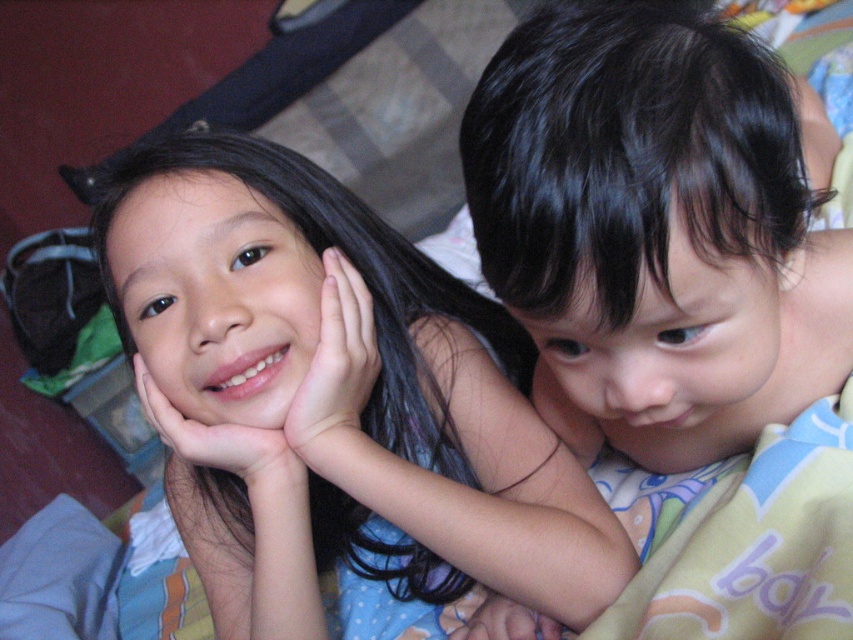
Is pink flesh-toned hand at center shorter than smooth skin hand at lower right?

No, pink flesh-toned hand at center is not shorter than smooth skin hand at lower right.

Is point (352, 314) farther from camera compared to point (560, 403)?

No, it is not.

Where is `pink flesh-toned hand at center`? This screenshot has width=853, height=640. pink flesh-toned hand at center is located at coordinates (335, 369).

Which of these two, smooth black hair at upper right or pink flesh-toned hand at center, stands taller?

Standing taller between the two is smooth black hair at upper right.

Is smooth black hair at upper right bigger than pink flesh-toned hand at center?

Yes, smooth black hair at upper right is bigger than pink flesh-toned hand at center.

Where is `smooth black hair at upper right`? smooth black hair at upper right is located at coordinates (657, 227).

Is the position of smooth skin girl at center more distant than that of pink flesh-toned hand at center?

No, it is in front of pink flesh-toned hand at center.

Which is more to the right, smooth skin girl at center or pink flesh-toned hand at center?

From the viewer's perspective, pink flesh-toned hand at center appears more on the right side.

Which is behind, point (508, 545) or point (363, 376)?

Positioned behind is point (363, 376).

You are a GUI agent. You are given a task and a screenshot of the screen. Output one action in this format:
    pyautogui.click(x=<x>, y=<y>)
    Task: Click on the smooth skin girl at center
    Image resolution: width=853 pixels, height=640 pixels.
    Given the screenshot: What is the action you would take?
    pyautogui.click(x=341, y=390)